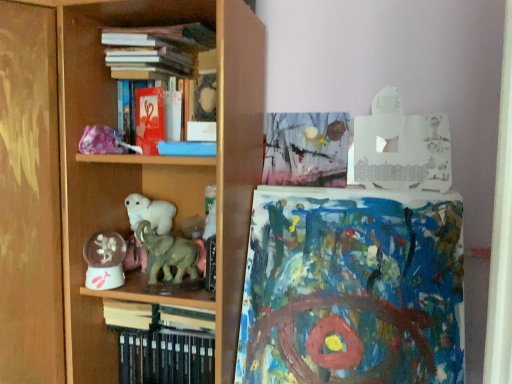
Question: Does green matte elephant at center appear on the left side of hardcover books at lower left, the 1th book positioned from the bottom?

Choices:
 (A) yes
 (B) no

Answer: (B)

Question: From a real-world perspective, is green matte elephant at center on top of hardcover books at lower left, arranged as the 4th book when viewed from the top?

Choices:
 (A) no
 (B) yes

Answer: (B)

Question: Is hardcover books at lower left, the 1th book positioned from the bottom, surrounded by green matte elephant at center?

Choices:
 (A) no
 (B) yes

Answer: (A)

Question: Is the position of green matte elephant at center less distant than that of hardcover books at lower left, arranged as the 4th book when viewed from the top?

Choices:
 (A) yes
 (B) no

Answer: (A)

Question: Is green matte elephant at center at the right side of hardcover books at lower left, arranged as the 4th book when viewed from the top?

Choices:
 (A) no
 (B) yes

Answer: (B)

Question: Is hardcover books at upper center, acting as the 1th book starting from the top, in front of or behind blue textured paper at center in the image?

Choices:
 (A) behind
 (B) front

Answer: (A)

Question: Is hardcover books at upper center, acting as the 1th book starting from the top, to the left or to the right of blue textured paper at center in the image?

Choices:
 (A) left
 (B) right

Answer: (A)

Question: From a real-world perspective, relative to blue textured paper at center, is hardcover books at upper center, the 4th book ordered from the bottom, vertically above or below?

Choices:
 (A) below
 (B) above

Answer: (B)

Question: Is hardcover books at upper center, acting as the 1th book starting from the top, bigger or smaller than blue textured paper at center?

Choices:
 (A) big
 (B) small

Answer: (B)

Question: From a real-world perspective, is hardcover book at center, which is the 3th book in top-to-bottom order, physically located above or below hardcover books at lower left, arranged as the 4th book when viewed from the top?

Choices:
 (A) above
 (B) below

Answer: (A)

Question: From the image's perspective, is hardcover book at center, which is the second book in bottom-to-top order, located above or below hardcover books at lower left, the 1th book positioned from the bottom?

Choices:
 (A) above
 (B) below

Answer: (A)

Question: Considering the positions of hardcover book at center, which is the second book in bottom-to-top order, and hardcover books at lower left, the 1th book positioned from the bottom, in the image, is hardcover book at center, which is the second book in bottom-to-top order, wider or thinner than hardcover books at lower left, the 1th book positioned from the bottom,?

Choices:
 (A) thin
 (B) wide

Answer: (A)

Question: Does point (197, 317) appear closer or farther from the camera than point (117, 309)?

Choices:
 (A) farther
 (B) closer

Answer: (B)

Question: Is hardcover book at center, which is the 3th book in top-to-bottom order, wider or thinner than translucent plastic snow globe at lower left?

Choices:
 (A) wide
 (B) thin

Answer: (A)

Question: Is hardcover book at center, which is the 3th book in top-to-bottom order, situated inside translucent plastic snow globe at lower left or outside?

Choices:
 (A) outside
 (B) inside

Answer: (A)